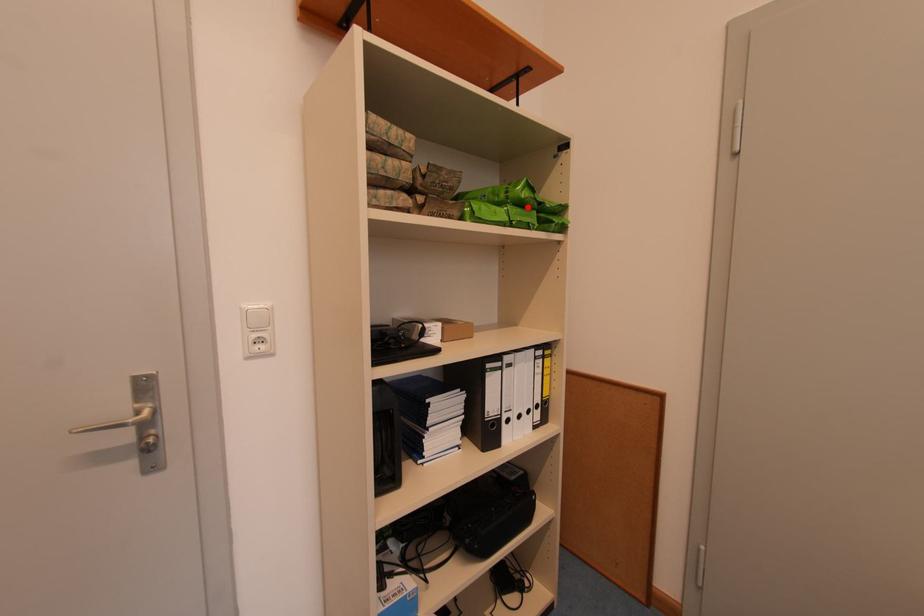
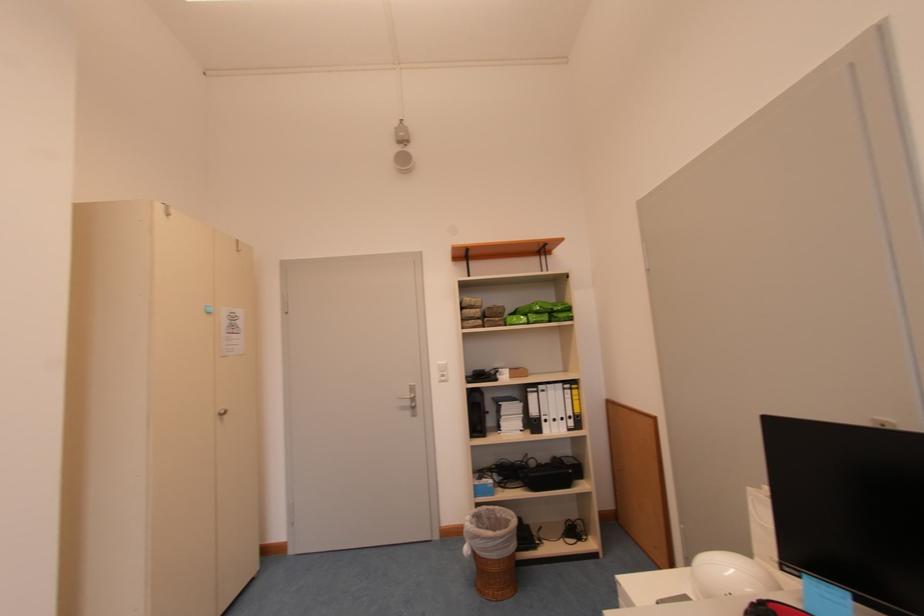
Find the pixel in the second image that matches the highlighted location in the first image.

(543, 315)